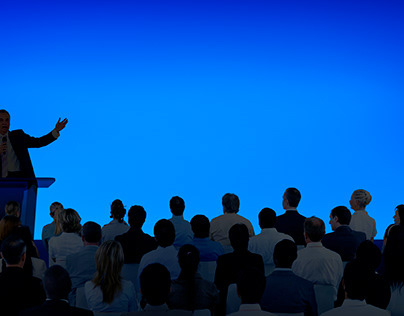
Identify the location of speaker. pos(22,153).